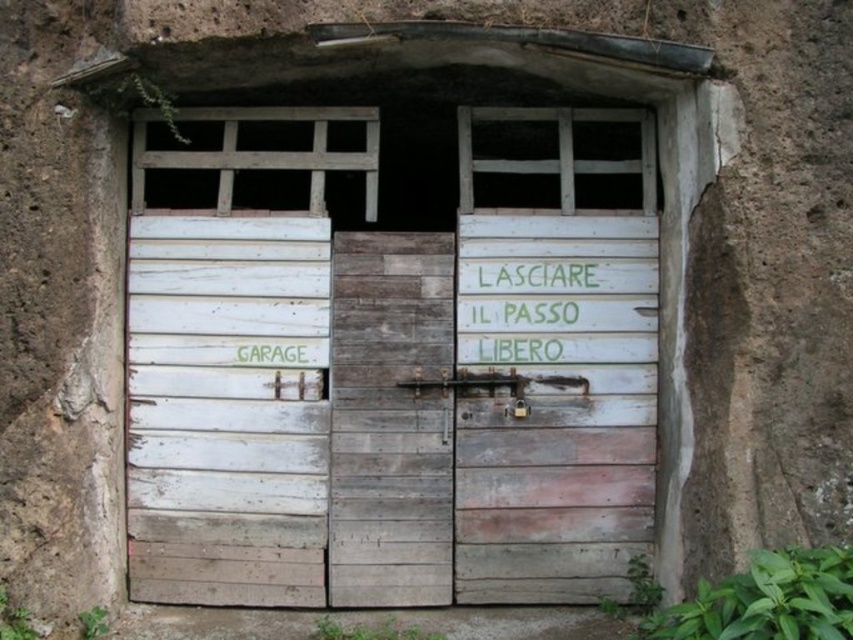
You are standing in front of a garage with a rough, textured wall. You need to locate the white weathered wood garage door at center. According to the coordinates provided, where exactly is it positioned?

The white weathered wood garage door at center is located at point coordinates of (392, 401).

You are a delivery person trying to deliver a large package to the address. The package is too wide to fit through a standard door. Looking at the image, which door should you use, the white weathered wood garage door at center or the white weathered wood door at center?

The white weathered wood garage door at center might be wider than white weathered wood door at center, so you should use the white weathered wood garage door at center to deliver the large package.

You are a delivery person trying to find the garage entrance. You see the white weathered wood door at left and the green painted wood sign at center. Which object is located below the other?

The white weathered wood door at left is positioned under the green painted wood sign at center, so the door is below the sign.